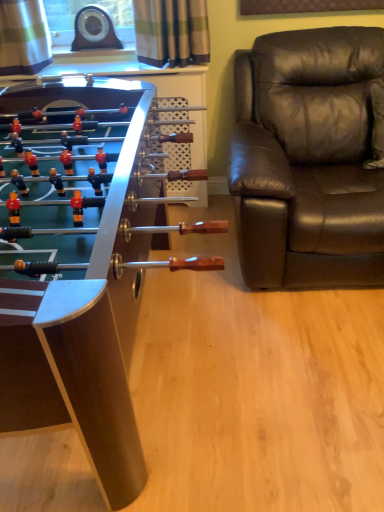
Question: Can you confirm if brown leather chair at right is smaller than metallic foosball table at left?

Choices:
 (A) yes
 (B) no

Answer: (A)

Question: Is brown leather chair at right in front of metallic foosball table at left?

Choices:
 (A) yes
 (B) no

Answer: (B)

Question: Does brown leather chair at right appear on the left side of metallic foosball table at left?

Choices:
 (A) yes
 (B) no

Answer: (B)

Question: From the image's perspective, is brown leather chair at right below metallic foosball table at left?

Choices:
 (A) no
 (B) yes

Answer: (A)

Question: Could you tell me if brown leather chair at right is turned towards metallic foosball table at left?

Choices:
 (A) no
 (B) yes

Answer: (A)

Question: From the image's perspective, would you say brown leather chair at right is positioned over metallic foosball table at left?

Choices:
 (A) yes
 (B) no

Answer: (A)

Question: Is metallic foosball table at left positioned far away from brown leather chair at right?

Choices:
 (A) yes
 (B) no

Answer: (B)

Question: Is metallic foosball table at left bigger than brown leather chair at right?

Choices:
 (A) yes
 (B) no

Answer: (A)

Question: Would you say brown leather chair at right is part of metallic foosball table at left's contents?

Choices:
 (A) yes
 (B) no

Answer: (B)

Question: Can you confirm if metallic foosball table at left is taller than brown leather chair at right?

Choices:
 (A) yes
 (B) no

Answer: (B)

Question: Does metallic foosball table at left have a lesser width compared to brown leather chair at right?

Choices:
 (A) no
 (B) yes

Answer: (A)

Question: Considering the relative positions of metallic foosball table at left and brown leather chair at right in the image provided, is metallic foosball table at left to the right of brown leather chair at right from the viewer's perspective?

Choices:
 (A) no
 (B) yes

Answer: (A)

Question: Looking at their shapes, would you say metallic foosball table at left is wider or thinner than brown leather chair at right?

Choices:
 (A) thin
 (B) wide

Answer: (B)